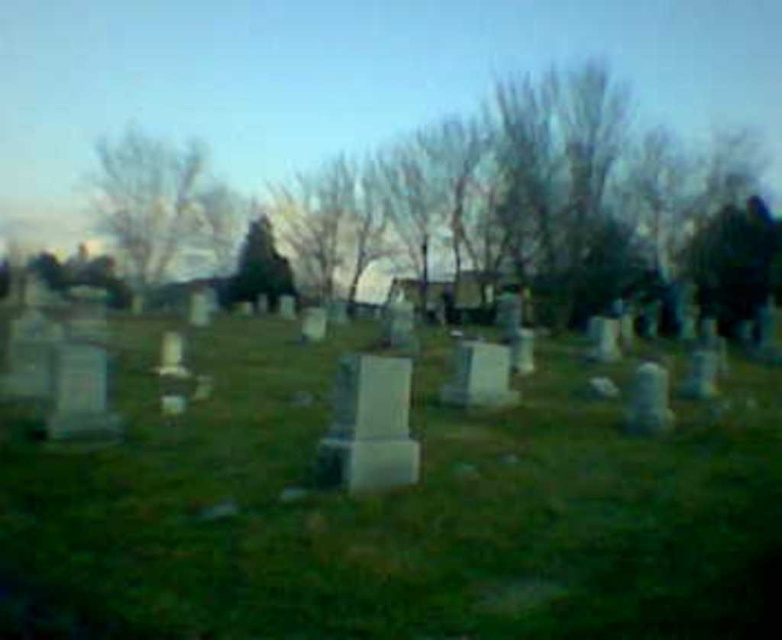
You are standing in the cemetery and want to touch both the white marble gravestone at center and the white stone gravestone at center. Which one should you reach for first?

The white marble gravestone at center is closer to you than the white stone gravestone at center, so you should reach for the white marble gravestone at center first.

You are a groundskeeper in the cemetery and need to place a new smooth gray stone at lower right next to the white stone gravestone at center. Considering their sizes, which stone should be placed closer to the path for easier access?

The smooth gray stone at lower right should be placed closer to the path since it is smaller in size than the white stone gravestone at center, making it easier to access.

You are standing at the edge of a cemetery and notice the white stone gravestone at center and the smooth gray stone at lower right. Based on their positions, which one do you think is wider?

The white stone gravestone at center might be wider than smooth gray stone at lower right according to the description.